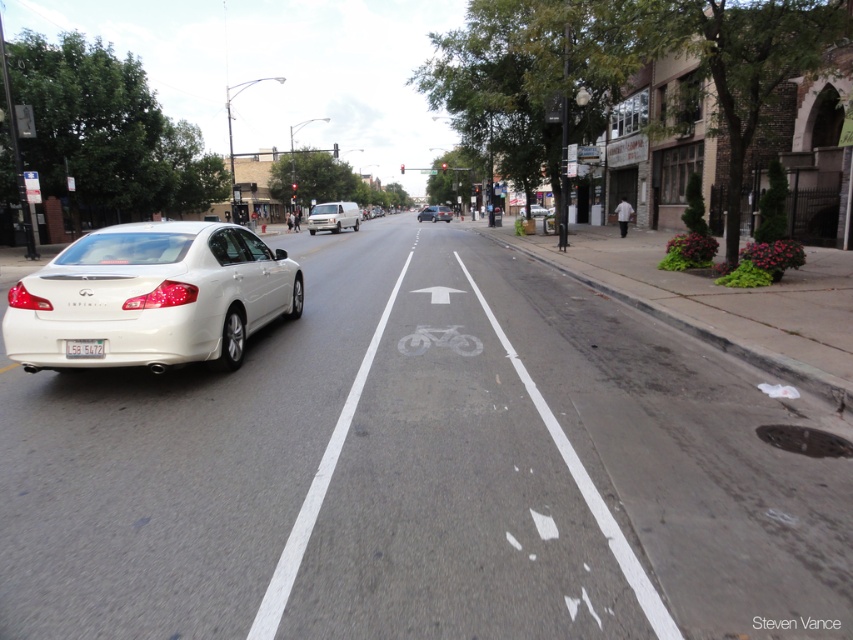
Does white glossy sedan at left appear on the left side of white matte van at center?

Incorrect, white glossy sedan at left is not on the left side of white matte van at center.

Who is lower down, white glossy sedan at left or white matte van at center?

white glossy sedan at left is below.

Measure the distance between point (88,266) and camera.

Point (88,266) is 21.01 feet from camera.

Locate an element on the screen. This screenshot has width=853, height=640. white glossy sedan at left is located at coordinates (151, 296).

Is white glossy sedan at left positioned before matte silver sedan at center?

Yes.

What are the coordinates of `white glossy sedan at left` in the screenshot? It's located at (151, 296).

Does white plastic license plate at center have a larger size compared to white matte sedan at center?

→ Incorrect, white plastic license plate at center is not larger than white matte sedan at center.

Between white plastic license plate at center and white matte sedan at center, which one appears on the right side from the viewer's perspective?

white matte sedan at center is more to the right.

Measure the distance between white plastic license plate at center and camera.

A distance of 6.06 meters exists between white plastic license plate at center and camera.

Find the location of a particular element. white plastic license plate at center is located at coordinates (84, 348).